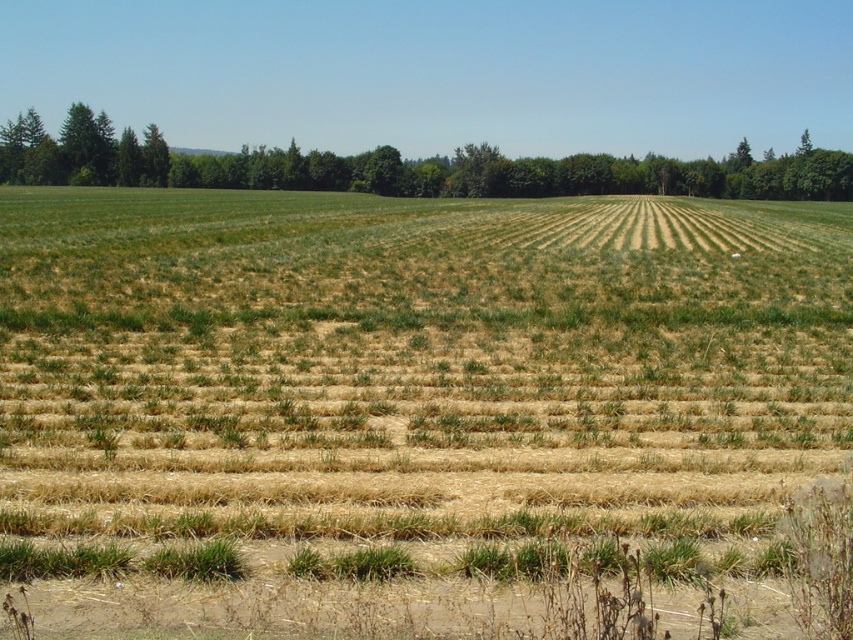
You are standing in the agricultural field and want to move from the point closer to you to the point further away. Which path would you take between the two points, point (268,513) and point (508,170)?

You should move from point (268,513) to point (508,170) because point (268,513) is closer to the viewer and you want to go to the further point.

You are a farmer standing at the edge of the field. You see the green grass at center and the green leafy tree at upper left. Which object is closer to you?

The green grass at center is closer to you because it is in front of the green leafy tree at upper left.